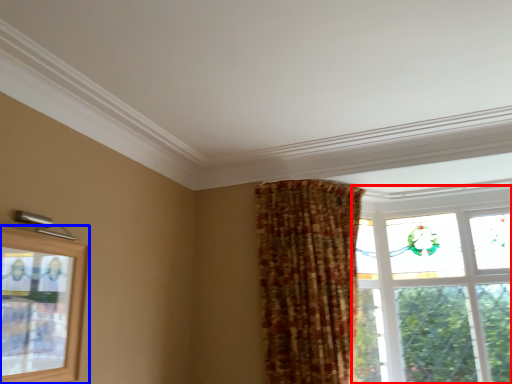
Question: Which object is closer to the camera taking this photo, window (highlighted by a red box) or window (highlighted by a blue box)?

Choices:
 (A) window
 (B) window

Answer: (B)